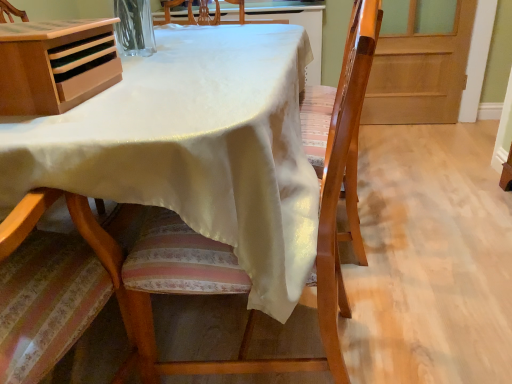
What do you see at coordinates (194, 148) in the screenshot?
I see `white satin tablecloth at center` at bounding box center [194, 148].

You are a GUI agent. You are given a task and a screenshot of the screen. Output one action in this format:
    pyautogui.click(x=<x>, y=<y>)
    Task: Click on the white satin tablecloth at center
    The height and width of the screenshot is (384, 512).
    Given the screenshot: What is the action you would take?
    pyautogui.click(x=194, y=148)

The width and height of the screenshot is (512, 384). What do you see at coordinates (420, 72) in the screenshot? I see `wooden screen door at right` at bounding box center [420, 72].

What do you see at coordinates (55, 64) in the screenshot? I see `light brown wood desk at upper left` at bounding box center [55, 64].

At what (x,y) coordinates should I click in order to perform the action: click on wooden chair at center. Please return your answer as a coordinate pair (x, y). This screenshot has height=384, width=512. Looking at the image, I should click on (231, 248).

Would you say wooden chair at center is outside wooden screen door at right?

Absolutely, wooden chair at center is external to wooden screen door at right.

Looking at this image, is the surface of wooden chair at center in direct contact with wooden screen door at right?

There is a gap between wooden chair at center and wooden screen door at right.

From a real-world perspective, which is physically above, wooden chair at center or wooden screen door at right?

In real-world perspective, wooden chair at center is above.

Is wooden screen door at right positioned with its back to white satin tablecloth at center?

No.

Is wooden screen door at right in front of white satin tablecloth at center?

No.

Considering the relative sizes of wooden screen door at right and white satin tablecloth at center in the image provided, is wooden screen door at right wider than white satin tablecloth at center?

No, wooden screen door at right is not wider than white satin tablecloth at center.

In the scene shown: Is wooden screen door at right not close to white satin tablecloth at center?

Indeed, wooden screen door at right is not near white satin tablecloth at center.

From a real-world perspective, between wooden chair at center and light brown wood desk at upper left, who is vertically lower?

From a 3D spatial view, wooden chair at center is below.

Based on the photo, is there a large distance between wooden chair at center and light brown wood desk at upper left?

No, there isn't a large distance between wooden chair at center and light brown wood desk at upper left.

Does wooden chair at center turn towards light brown wood desk at upper left?

Yes, wooden chair at center is turned towards light brown wood desk at upper left.

Consider the image. From a real-world perspective, is white satin tablecloth at center beneath wooden chair at center?

Yes, from a real-world perspective, white satin tablecloth at center is beneath wooden chair at center.

Does point (221, 64) come farther from viewer compared to point (331, 238)?

Yes.

Is white satin tablecloth at center facing away from wooden chair at center?

That's not correct — white satin tablecloth at center is not looking away from wooden chair at center.

Which object is wider, white satin tablecloth at center or wooden chair at center?

white satin tablecloth at center is wider.

From a real-world perspective, is wooden chair at center on white satin tablecloth at center?

Yes.

Is wooden chair at center bigger than white satin tablecloth at center?

No.

From the image's perspective, between wooden chair at center and white satin tablecloth at center, which one is located above?

white satin tablecloth at center appears higher in the image.

Is wooden chair at center to the left of white satin tablecloth at center from the viewer's perspective?

No, wooden chair at center is not to the left of white satin tablecloth at center.

Does light brown wood desk at upper left have a lesser height compared to white satin tablecloth at center?

Correct, light brown wood desk at upper left is not as tall as white satin tablecloth at center.

Which object is thinner, light brown wood desk at upper left or white satin tablecloth at center?

Thinner between the two is light brown wood desk at upper left.

Is light brown wood desk at upper left surrounding white satin tablecloth at center?

No, white satin tablecloth at center is not inside light brown wood desk at upper left.

From a real-world perspective, is light brown wood desk at upper left under white satin tablecloth at center?

Actually, light brown wood desk at upper left is physically above white satin tablecloth at center in the real world.

From a real-world perspective, is wooden screen door at right positioned over light brown wood desk at upper left based on gravity?

No, from a real-world perspective, wooden screen door at right is not over light brown wood desk at upper left

At what (x,y) coordinates should I click in order to perform the action: click on cabinetry that appears in front of the wooden screen door at right. Please return your answer as a coordinate pair (x, y). Looking at the image, I should click on (55, 64).

In the scene shown: Is wooden screen door at right with light brown wood desk at upper left?

No, wooden screen door at right is not next to light brown wood desk at upper left.

In the image, is wooden screen door at right on the left side or the right side of light brown wood desk at upper left?

Based on their positions, wooden screen door at right is located to the right of light brown wood desk at upper left.

This screenshot has height=384, width=512. In order to click on chair above the wooden screen door at right (from a real-world perspective) in this screenshot , I will do `click(231, 248)`.

Locate an element on the screen. screen door behind the white satin tablecloth at center is located at coordinates (420, 72).

Considering their positions, is wooden chair at center positioned further to white satin tablecloth at center than light brown wood desk at upper left?

wooden chair at center.

From the image, which object appears to be farther from light brown wood desk at upper left, white satin tablecloth at center or wooden chair at center?

Among the two, wooden chair at center is located further to light brown wood desk at upper left.

When comparing their distances from white satin tablecloth at center, does light brown wood desk at upper left or wooden screen door at right seem closer?

The object closer to white satin tablecloth at center is light brown wood desk at upper left.

When comparing their distances from wooden chair at center, does white satin tablecloth at center or light brown wood desk at upper left seem closer?

Based on the image, white satin tablecloth at center appears to be nearer to wooden chair at center.

When comparing their distances from wooden chair at center, does wooden screen door at right or white satin tablecloth at center seem further?

Based on the image, wooden screen door at right appears to be further to wooden chair at center.

Which object lies further to the anchor point wooden chair at center, wooden screen door at right or light brown wood desk at upper left?

Based on the image, wooden screen door at right appears to be further to wooden chair at center.

Looking at the image, which one is located closer to wooden chair at center, light brown wood desk at upper left or wooden screen door at right?

Among the two, light brown wood desk at upper left is located nearer to wooden chair at center.

Considering their positions, is white satin tablecloth at center positioned further to light brown wood desk at upper left than wooden screen door at right?

Among the two, wooden screen door at right is located further to light brown wood desk at upper left.

At what (x,y) coordinates should I click in order to perform the action: click on table located between light brown wood desk at upper left and wooden chair at center in the left-right direction. Please return your answer as a coordinate pair (x, y). Looking at the image, I should click on (194, 148).

Find the location of `cabinetry located between white satin tablecloth at center and wooden screen door at right in the depth direction`. cabinetry located between white satin tablecloth at center and wooden screen door at right in the depth direction is located at coordinates (55, 64).

Locate an element on the screen. chair between white satin tablecloth at center and wooden screen door at right in the front-back direction is located at coordinates (231, 248).

At what (x,y) coordinates should I click in order to perform the action: click on cabinetry between wooden chair at center and wooden screen door at right in the front-back direction. Please return your answer as a coordinate pair (x, y). The height and width of the screenshot is (384, 512). Looking at the image, I should click on (55, 64).